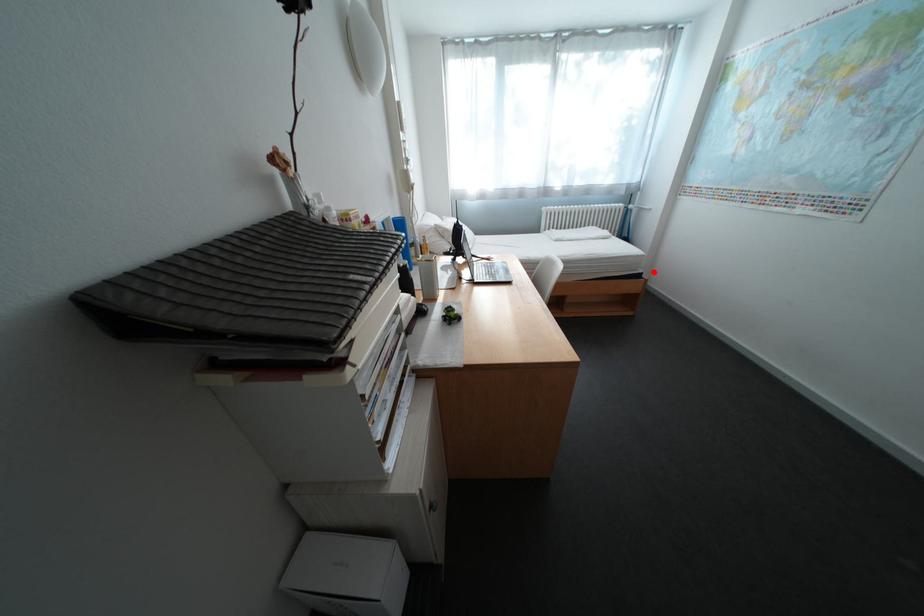
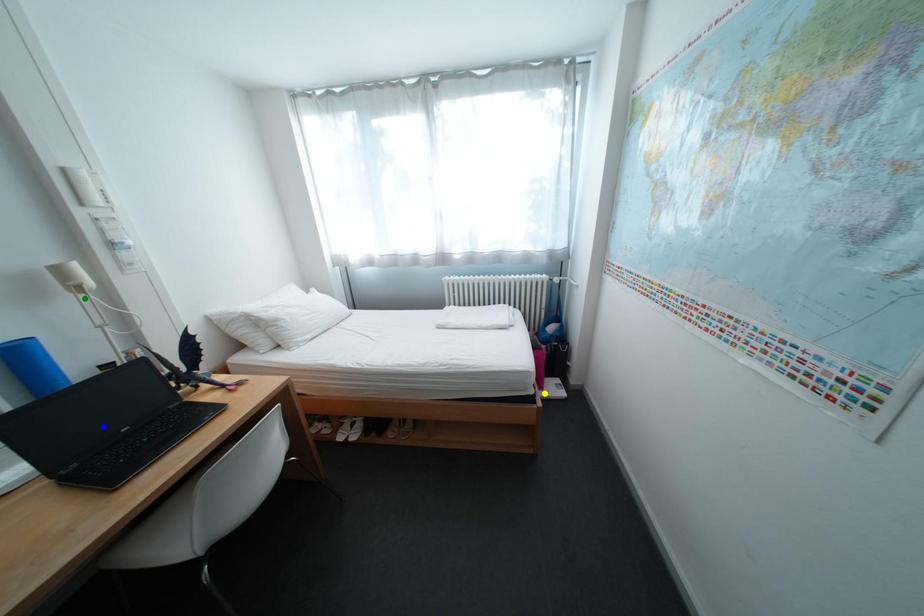
Question: I am providing you with two images of the same scene from different viewpoints. A red point is marked on the first image. You are given multiple points on the second image. Which point in image 2 represents the same 3d spot as the red point in image 1?

Choices:
 (A) blue point
 (B) green point
 (C) yellow point

Answer: (C)